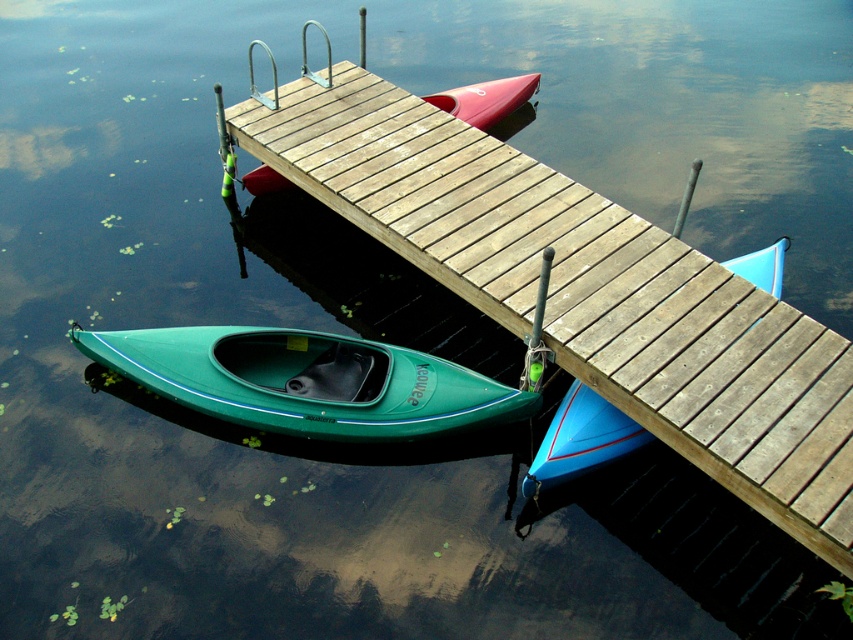
Where is `wooden dock at center`? wooden dock at center is located at coordinates (585, 291).

Does wooden dock at center appear on the right side of green matte kayak at lower left?

Indeed, wooden dock at center is positioned on the right side of green matte kayak at lower left.

Who is more distant from viewer, (x=622, y=253) or (x=311, y=433)?

The point (x=622, y=253) is more distant.

The height and width of the screenshot is (640, 853). In order to click on wooden dock at center in this screenshot , I will do `click(585, 291)`.

Which of these two, green matte kayak at lower left or matte red canoe at center, stands taller?

Standing taller between the two is matte red canoe at center.

Does green matte kayak at lower left have a larger size compared to matte red canoe at center?

Correct, green matte kayak at lower left is larger in size than matte red canoe at center.

This screenshot has width=853, height=640. Find the location of `green matte kayak at lower left`. green matte kayak at lower left is located at coordinates (306, 381).

Who is taller, green matte kayak at lower left or blue matte canoe at center?

With more height is green matte kayak at lower left.

How much distance is there between green matte kayak at lower left and blue matte canoe at center?

green matte kayak at lower left is 1.39 meters from blue matte canoe at center.

Which is behind, point (344, 388) or point (596, 442)?

Positioned behind is point (344, 388).

Where is `green matte kayak at lower left`? This screenshot has height=640, width=853. green matte kayak at lower left is located at coordinates (306, 381).